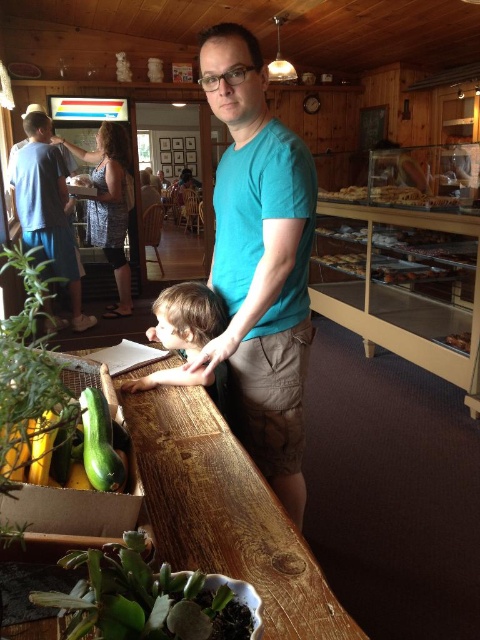
Does green matte succulent at lower left appear on the right side of translucent glass pastries at upper right?

Incorrect, green matte succulent at lower left is not on the right side of translucent glass pastries at upper right.

Is the position of green matte succulent at lower left less distant than that of translucent glass pastries at upper right?

Yes.

Find the location of `green matte succulent at lower left`. green matte succulent at lower left is located at coordinates (147, 598).

Does smooth brown hair at center appear on the right side of golden brown pastry at center?

No, smooth brown hair at center is not to the right of golden brown pastry at center.

Between smooth brown hair at center and golden brown pastry at center, which one appears on the right side from the viewer's perspective?

golden brown pastry at center

Which is behind, point (203, 308) or point (469, 333)?

The point (469, 333) is more distant.

The width and height of the screenshot is (480, 640). Find the location of `smooth brown hair at center`. smooth brown hair at center is located at coordinates (188, 317).

Consider the image. Does teal cotton shirt at center have a lesser height compared to golden brown pastry at center?

No, teal cotton shirt at center is not shorter than golden brown pastry at center.

Between teal cotton shirt at center and golden brown pastry at center, which one appears on the left side from the viewer's perspective?

teal cotton shirt at center is more to the left.

At what (x,y) coordinates should I click in order to perform the action: click on teal cotton shirt at center. Please return your answer as a coordinate pair (x, y). This screenshot has width=480, height=640. Looking at the image, I should click on (261, 257).

This screenshot has height=640, width=480. What are the coordinates of `teal cotton shirt at center` in the screenshot? It's located at (261, 257).